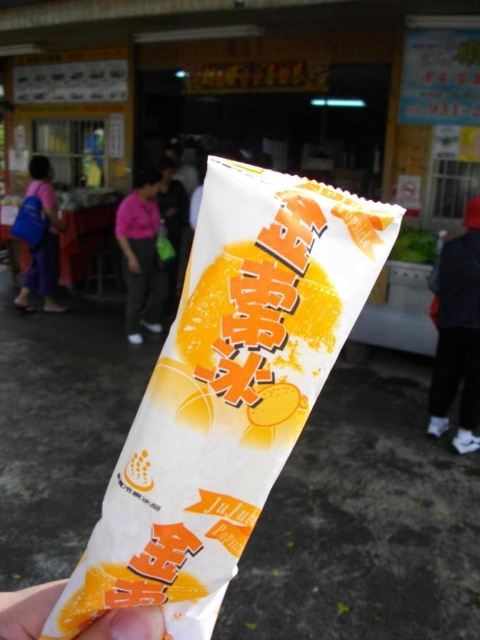
You are a photographer trying to capture both the pink fabric shirt at center and the white paper at center in a single frame. Based on their sizes, which object should you focus on first to ensure both are clearly visible in the photo?

The pink fabric shirt at center has a larger size compared to white paper at center, so you should focus on the pink fabric shirt at center first to ensure both are clearly visible in the photo.

You are a delivery person holding a package that is 1.2 meters wide. You need to walk through a narrow alley between the dark blue jeans at lower right and the white paper at center. Can your package fit through the alley?

The dark blue jeans at lower right might be wider than white paper at center, so the alley between them could be wide enough for the package that is 1.2 meters wide. However, since the exact width isn not specified, there is uncertainty. If the jeans are indeed wider, the space might accommodate the package.